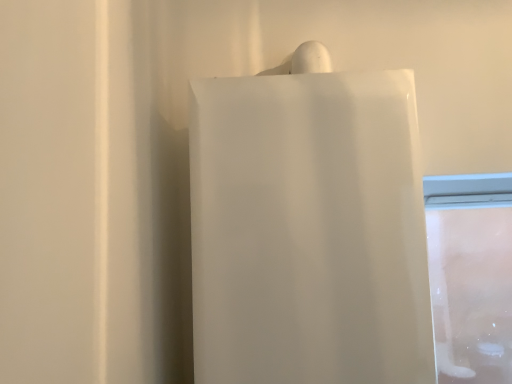
You are a GUI agent. You are given a task and a screenshot of the screen. Output one action in this format:
    pyautogui.click(x=<x>, y=<y>)
    Task: Click on the transparent glass window at right
    This screenshot has height=384, width=512.
    Given the screenshot: What is the action you would take?
    pyautogui.click(x=471, y=275)

The height and width of the screenshot is (384, 512). What do you see at coordinates (471, 275) in the screenshot? I see `transparent glass window at right` at bounding box center [471, 275].

What is the approximate width of transparent glass window at right?

transparent glass window at right is 2.40 inches wide.

Locate an element on the screen. Image resolution: width=512 pixels, height=384 pixels. transparent glass window at right is located at coordinates (471, 275).